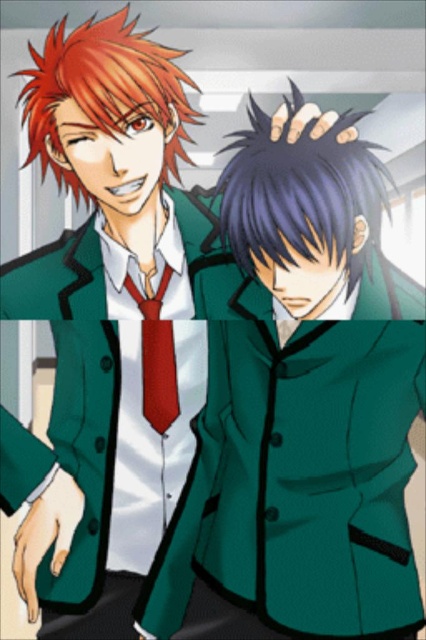
You are a tailor inspecting a mannequin dressed in the green woolen blazer at center and the matte red tie at center. Can you adjust the blazer to make the tie more visible? How?

The green woolen blazer at center is currently in front of the matte red tie at center. To make the tie more visible, you can adjust the blazer by pulling it back or tucking it in so that it no longer covers the tie.

What is the exact coordinate position of the green woolen blazer at center in the image?

The green woolen blazer at center is located at point (301, 481).